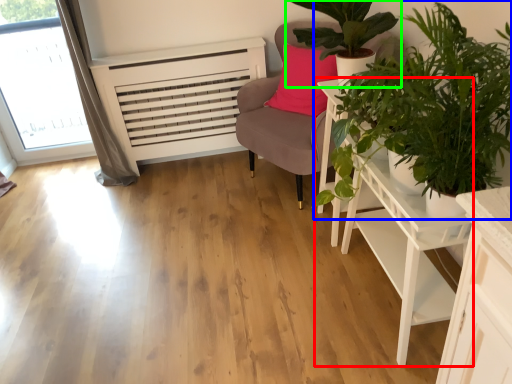
Question: Based on their relative distances, which object is farther from table (highlighted by a red box)? Choose from houseplant (highlighted by a blue box) and houseplant (highlighted by a green box).

Choices:
 (A) houseplant
 (B) houseplant

Answer: (B)